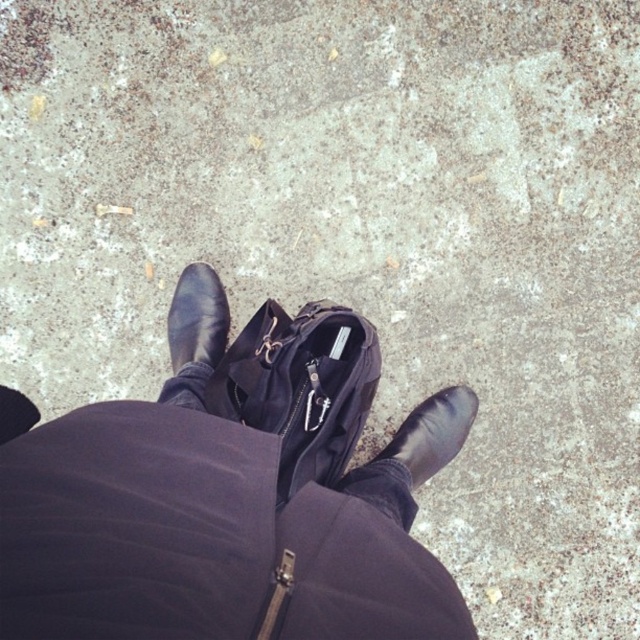
You are a photographer trying to capture a detailed shot of both the black leather shoe at lower center and the black leather shoe at center. Since you want to ensure both are clearly visible, which shoe should you focus on first to account for their size difference?

The black leather shoe at lower center is larger in size than the black leather shoe at center, so you should focus on the black leather shoe at lower center first to ensure its details are sharp before adjusting for the smaller one.

You are a photographer trying to capture a detailed shot of the black leather shoes at center and the black leather shoe at center. Which one should you focus on if you want to photograph the taller object?

The black leather shoes at center is much taller than the black leather shoe at center, so you should focus on the black leather shoes at center.

You are a delivery robot that needs to place a package between the black leather shoes at center and the black leather shoe at lower center. What is the minimum distance you should maintain between the two shoes to ensure the package fits?

The minimum distance you should maintain between the black leather shoes at center and the black leather shoe at lower center is 54.56 centimeters to ensure the package fits.